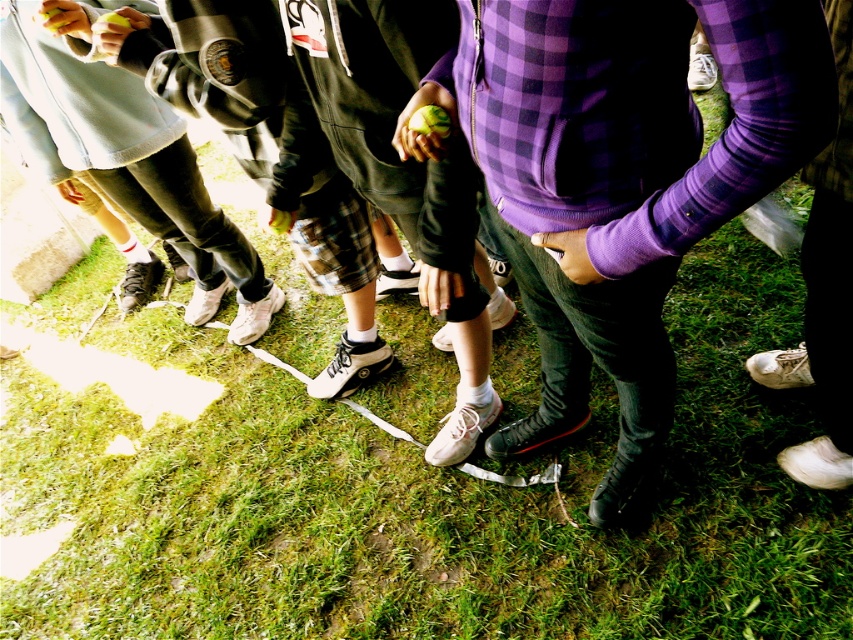
Question: Does purple checkered hoodie at center appear on the right side of light blue fleece jacket at lower left?

Choices:
 (A) yes
 (B) no

Answer: (A)

Question: Is light blue fleece jacket at lower left closer to camera compared to white leather shoe at lower right?

Choices:
 (A) yes
 (B) no

Answer: (B)

Question: Considering the real-world distances, which object is closest to the light blue fleece jacket at lower left?

Choices:
 (A) white leather shoe at lower right
 (B) purple checkered hoodie at center

Answer: (B)

Question: Based on their relative distances, which object is nearer to the light blue fleece jacket at lower left?

Choices:
 (A) white leather shoe at lower right
 (B) purple checkered hoodie at center

Answer: (B)

Question: Can you confirm if light blue fleece jacket at lower left is wider than white leather shoe at lower right?

Choices:
 (A) yes
 (B) no

Answer: (A)

Question: Estimate the real-world distances between objects in this image. Which object is farther from the white leather shoe at lower right?

Choices:
 (A) purple checkered hoodie at center
 (B) light blue fleece jacket at lower left

Answer: (B)